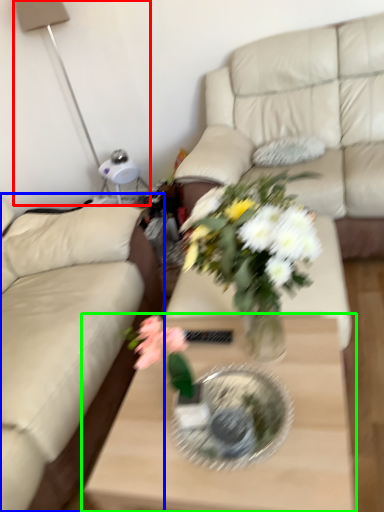
Question: Estimate the real-world distances between objects in this image. Which object is farther from table lamp (highlighted by a red box), studio couch (highlighted by a blue box) or coffee table (highlighted by a green box)?

Choices:
 (A) studio couch
 (B) coffee table

Answer: (B)